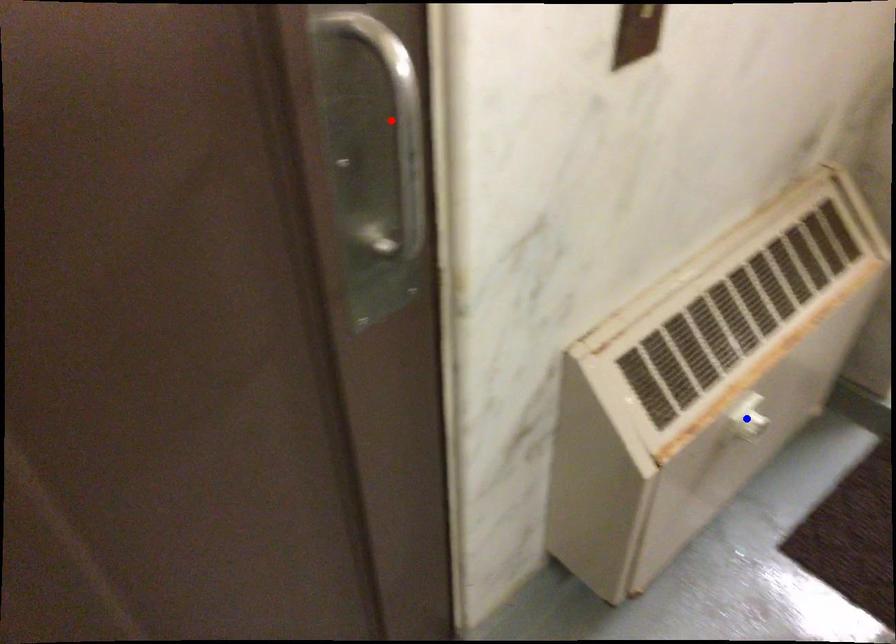
Question: Two points are marked on the image. Which point is closer to the camera?

Choices:
 (A) Blue point is closer.
 (B) Red point is closer.

Answer: (B)